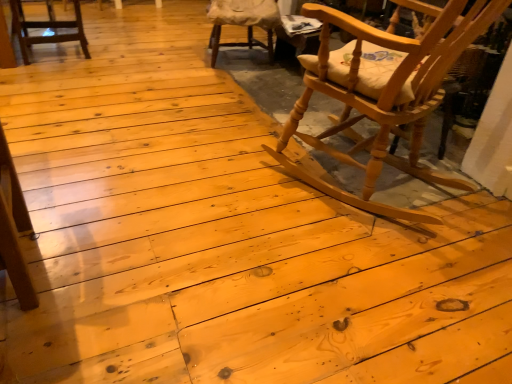
What are the coordinates of `unoccupied area in front of matte wood chair at upper left, which is the 3th chair in right-to-left order` in the screenshot? It's located at point(46,76).